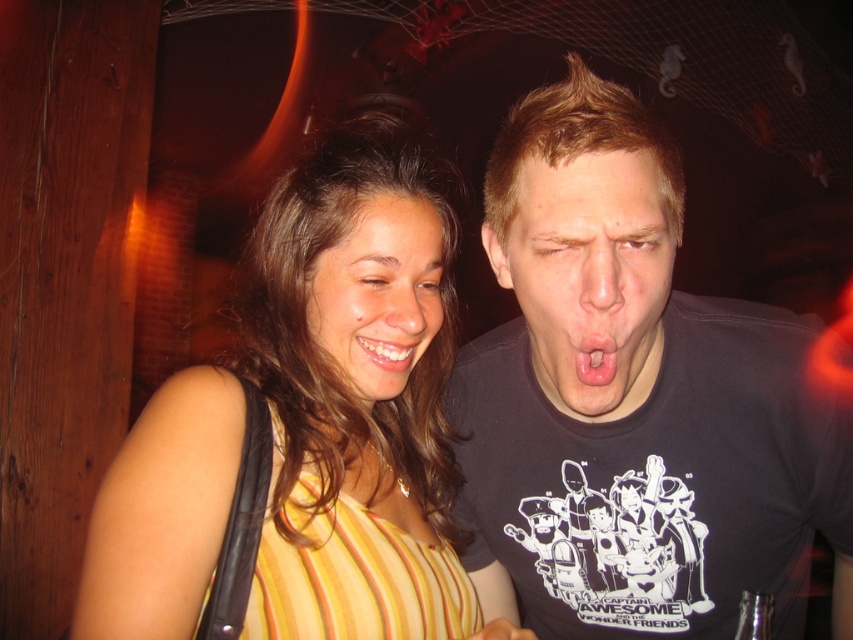
Question: Does yellow striped dress at center have a greater width compared to matte black shirt at center?

Choices:
 (A) no
 (B) yes

Answer: (B)

Question: Does smooth skin face at center appear under white glossy teeth at lower center?

Choices:
 (A) yes
 (B) no

Answer: (B)

Question: Among these points, which one is nearest to the camera?

Choices:
 (A) (548, 314)
 (B) (366, 209)
 (C) (436, 289)

Answer: (A)

Question: Considering the real-world distances, which object is farthest from the smooth skin face at center?

Choices:
 (A) yellow striped dress at center
 (B) pink matte tongue at center
 (C) white glossy teeth at lower center

Answer: (B)

Question: Considering the relative positions of yellow striped dress at center and smooth skin face at center in the image provided, where is yellow striped dress at center located with respect to smooth skin face at center?

Choices:
 (A) below
 (B) above

Answer: (A)

Question: Which of the following is the closest to the observer?

Choices:
 (A) (370, 406)
 (B) (645, 253)
 (C) (576, 353)
 (D) (204, 372)

Answer: (B)